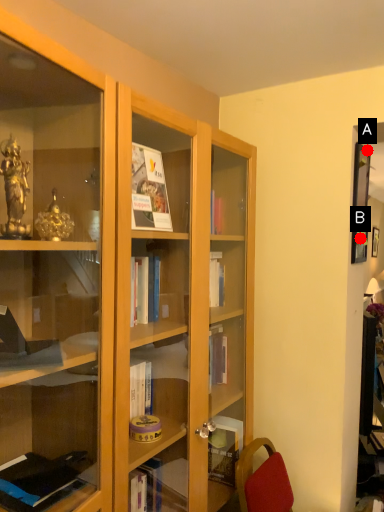
Question: Two points are circled on the image, labeled by A and B beside each circle. Which point appears closest to the camera in this image?

Choices:
 (A) A is closer
 (B) B is closer

Answer: (A)